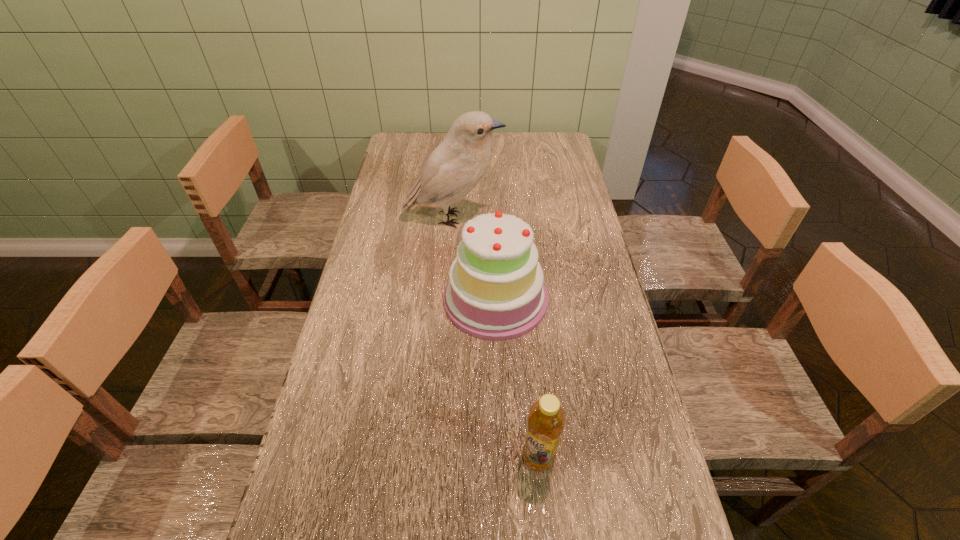
This screenshot has height=540, width=960. In the image, there is a desktop. What are the coordinates of `vacant space at the right edge` in the screenshot? It's located at (561, 299).

This screenshot has height=540, width=960. What are the coordinates of `vacant region between the nearest object and the cake` in the screenshot? It's located at (517, 378).

This screenshot has width=960, height=540. In order to click on the second closest object relative to the nearest object in this screenshot , I will do `click(458, 163)`.

Identify the location of object that is the closest to the nearest object. (496, 292).

This screenshot has width=960, height=540. Identify the location of free space that satisfies the following two spatial constraints: 1. on the back side of the bottle; 2. on the face of the parakeet. (516, 219).

The height and width of the screenshot is (540, 960). I want to click on vacant region that satisfies the following two spatial constraints: 1. on the face of the tallest object; 2. on the back side of the bottle, so click(x=436, y=457).

Where is `free space that satisfies the following two spatial constraints: 1. on the face of the nearest object; 2. on the left side of the farthest object`? This screenshot has height=540, width=960. free space that satisfies the following two spatial constraints: 1. on the face of the nearest object; 2. on the left side of the farthest object is located at coordinates (436, 457).

Where is `free space that satisfies the following two spatial constraints: 1. on the face of the nearest object; 2. on the right side of the farthest object`? The height and width of the screenshot is (540, 960). free space that satisfies the following two spatial constraints: 1. on the face of the nearest object; 2. on the right side of the farthest object is located at coordinates (436, 457).

Where is `free space that satisfies the following two spatial constraints: 1. on the face of the parakeet; 2. on the back side of the cake`? free space that satisfies the following two spatial constraints: 1. on the face of the parakeet; 2. on the back side of the cake is located at coordinates (447, 299).